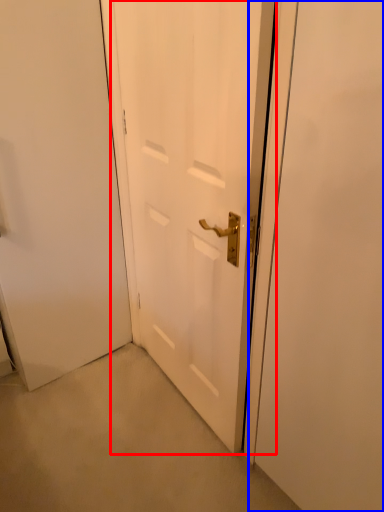
Question: Among these objects, which one is nearest to the camera, door (highlighted by a red box) or screen door (highlighted by a blue box)?

Choices:
 (A) door
 (B) screen door

Answer: (B)